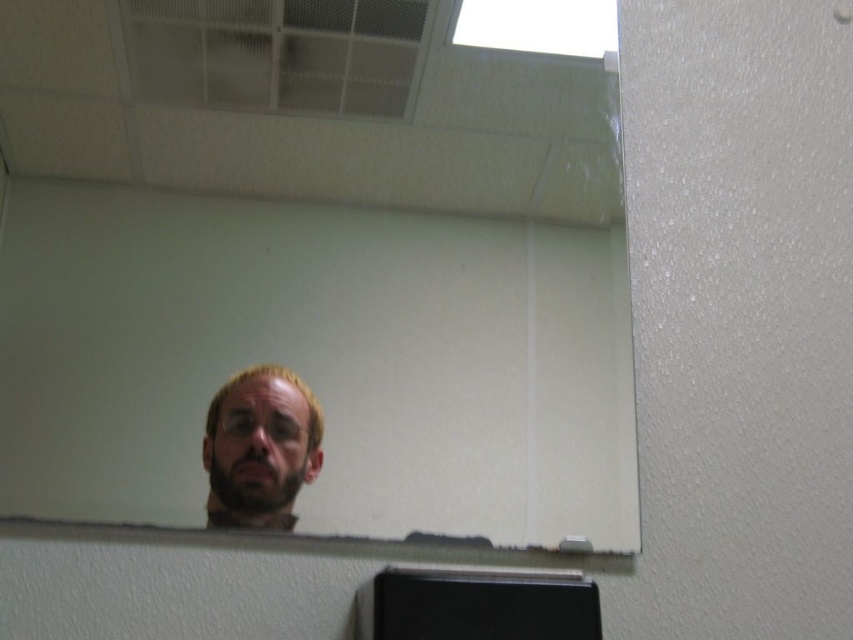
Between point (624, 349) and point (318, 452), which one is positioned behind?

Positioned behind is point (624, 349).

Does clear glass mirror at center have a greater width compared to light brown hair at center?

Correct, the width of clear glass mirror at center exceeds that of light brown hair at center.

Between point (416, 532) and point (258, 396), which one is positioned behind?

Positioned behind is point (258, 396).

This screenshot has height=640, width=853. I want to click on clear glass mirror at center, so click(311, 273).